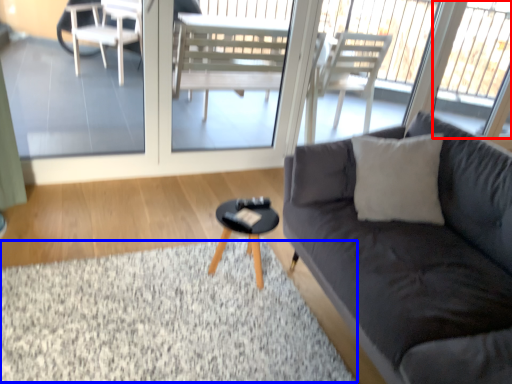
Question: Which object appears farthest to the camera in this image, window (highlighted by a red box) or flat (highlighted by a blue box)?

Choices:
 (A) window
 (B) flat

Answer: (A)